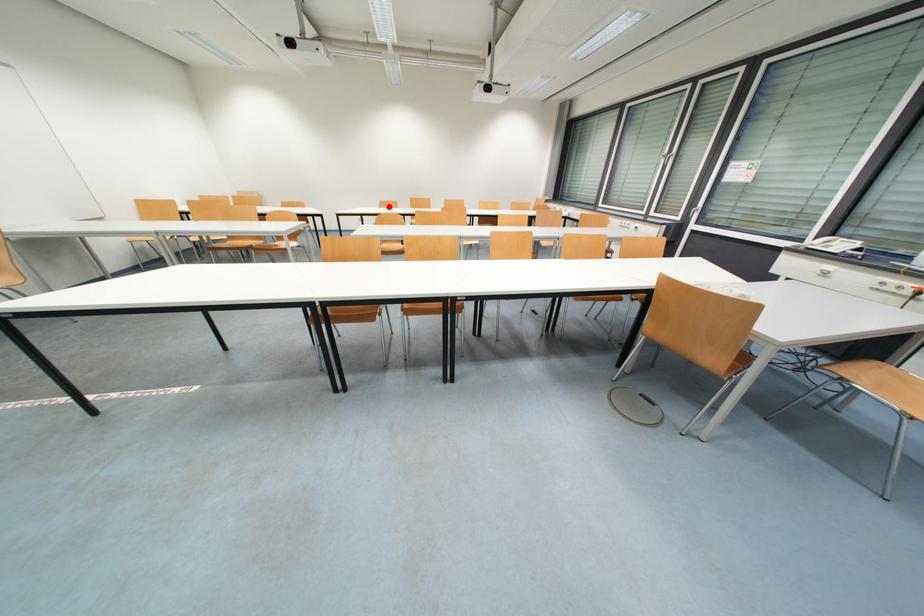
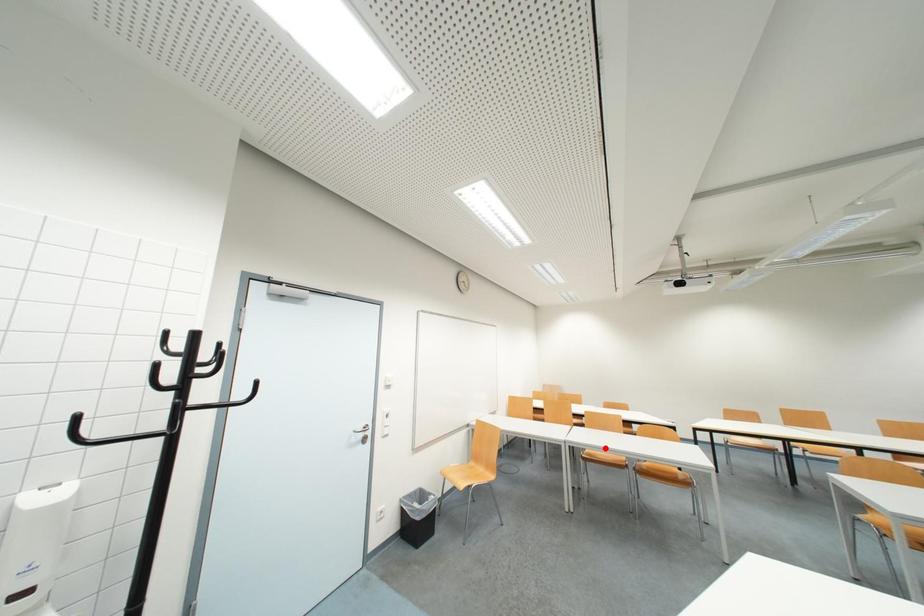
I am providing you with two images of the same scene from different viewpoints. A red point is marked on the first image and another point is marked on the second image. Do the highlighted points in image1 and image2 indicate the same real-world spot?

No